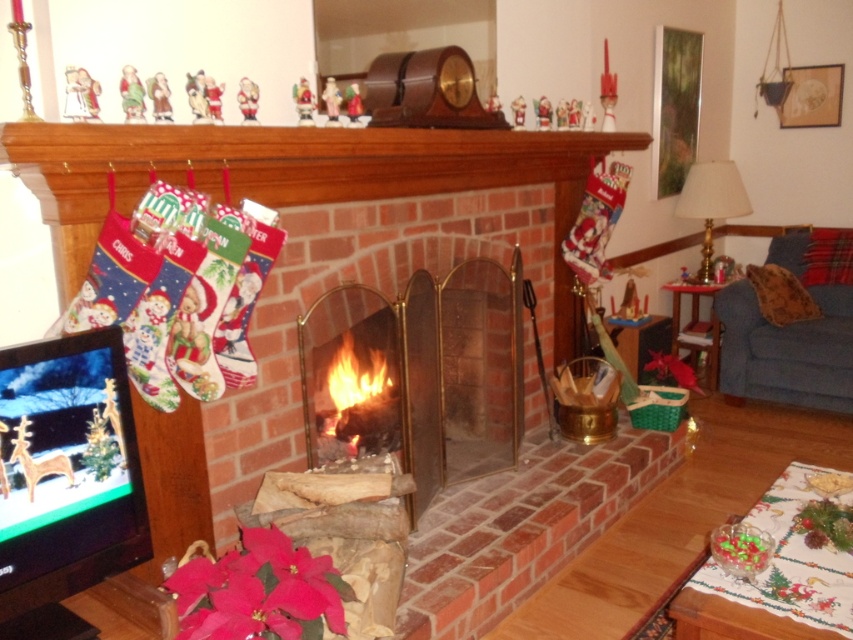
You are standing in the living room and want to place a small gift under the Christmas tree. The Christmas tree is located at the center of the room. However, you notice the pink matte poinsettia at lower left is blocking the path. Can you move the poinsettia to make space?

The pink matte poinsettia at lower left is located at point (259, 592), so moving it would create space to place the gift under the Christmas tree at the center.

You are standing in the living room and want to place a new decoration on the mantel above the brick fireplace at center. If the mantel is 1.2 meters wide, can you fit a 1.5 meter long decoration horizontally?

The mantel is 1.2 meters wide, and the decoration is 1.5 meters long, so it will not fit horizontally. You need a shorter decoration or a wider mantel.

You are standing in the living room and want to place a small gift under the Christmas tree. The gift is currently at point [259,592]. Which object is located at this point?

The point [259,592] corresponds to the pink matte poinsettia at lower left.